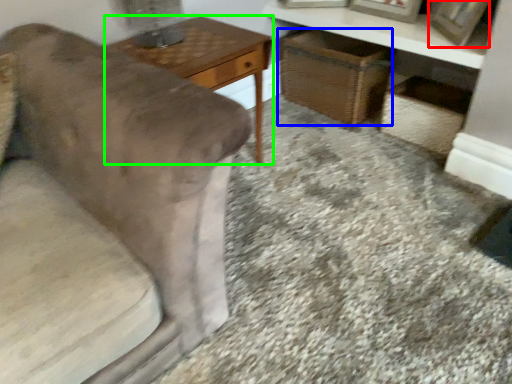
Question: Which is nearer to the picture frame (highlighted by a red box)? basket (highlighted by a blue box) or table (highlighted by a green box).

Choices:
 (A) basket
 (B) table

Answer: (A)